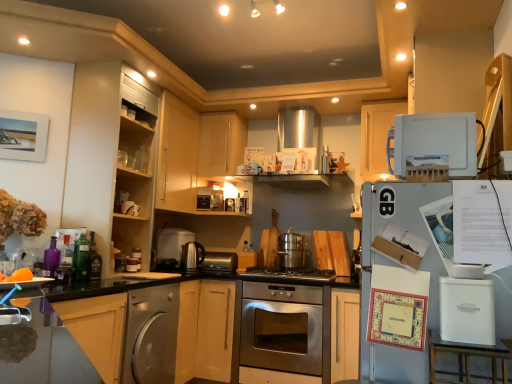
Question: Would you say stainless steel oven at center is outside white matte cabinet at upper right, the first cabinetry positioned from the right?

Choices:
 (A) yes
 (B) no

Answer: (A)

Question: From the image's perspective, is stainless steel oven at center over white matte cabinet at upper right, positioned as the 3th cabinetry in left-to-right order?

Choices:
 (A) yes
 (B) no

Answer: (B)

Question: Can you confirm if stainless steel oven at center is bigger than white matte cabinet at upper right, the first cabinetry positioned from the right?

Choices:
 (A) no
 (B) yes

Answer: (B)

Question: Could white matte cabinet at upper right, positioned as the 3th cabinetry in left-to-right order, be considered to be inside stainless steel oven at center?

Choices:
 (A) yes
 (B) no

Answer: (B)

Question: Is stainless steel oven at center wider than white matte cabinet at upper right, the first cabinetry positioned from the right?

Choices:
 (A) yes
 (B) no

Answer: (A)

Question: From their relative heights in the image, would you say translucent glass bottle at center, the fifth bottle from the front, is taller or shorter than purple glass bottle at left, positioned as the first bottle in left-to-right order?

Choices:
 (A) tall
 (B) short

Answer: (A)

Question: Considering the relative positions of translucent glass bottle at center, the fifth bottle when ordered from left to right, and purple glass bottle at left, positioned as the fifth bottle in right-to-left order, in the image provided, is translucent glass bottle at center, the fifth bottle when ordered from left to right, to the left or to the right of purple glass bottle at left, positioned as the fifth bottle in right-to-left order,?

Choices:
 (A) right
 (B) left

Answer: (A)

Question: From the image's perspective, relative to purple glass bottle at left, acting as the first bottle starting from the front, is translucent glass bottle at center, the first bottle from the back, above or below?

Choices:
 (A) above
 (B) below

Answer: (B)

Question: Is translucent glass bottle at center, the fifth bottle when ordered from left to right, spatially inside purple glass bottle at left, positioned as the first bottle in left-to-right order, or outside of it?

Choices:
 (A) outside
 (B) inside

Answer: (A)

Question: Would you say matte wood cabinet at upper center, positioned as the 2th cabinetry in right-to-left order, is to the left or to the right of satin silver toaster at center, which is the first appliance from bottom to top, in the picture?

Choices:
 (A) right
 (B) left

Answer: (A)

Question: Considering the positions of matte wood cabinet at upper center, positioned as the 2th cabinetry in right-to-left order, and satin silver toaster at center, the 5th appliance from the top, in the image, is matte wood cabinet at upper center, positioned as the 2th cabinetry in right-to-left order, wider or thinner than satin silver toaster at center, the 5th appliance from the top,?

Choices:
 (A) wide
 (B) thin

Answer: (A)

Question: Considering the positions of matte wood cabinet at upper center, positioned as the 2th cabinetry in right-to-left order, and satin silver toaster at center, the second appliance viewed from the back, in the image, is matte wood cabinet at upper center, positioned as the 2th cabinetry in right-to-left order, taller or shorter than satin silver toaster at center, the second appliance viewed from the back,?

Choices:
 (A) tall
 (B) short

Answer: (A)

Question: In the image, is matte wood cabinet at upper center, positioned as the 2th cabinetry in right-to-left order, positioned in front of or behind satin silver toaster at center, the second appliance viewed from the back?

Choices:
 (A) behind
 (B) front

Answer: (A)

Question: From a real-world perspective, is green glass bottle at left, which is the 2th bottle from back to front, physically located above or below satin silver dishwasher at lower left?

Choices:
 (A) above
 (B) below

Answer: (A)

Question: Considering the positions of point (89, 259) and point (177, 284), is point (89, 259) closer or farther from the camera than point (177, 284)?

Choices:
 (A) closer
 (B) farther

Answer: (A)